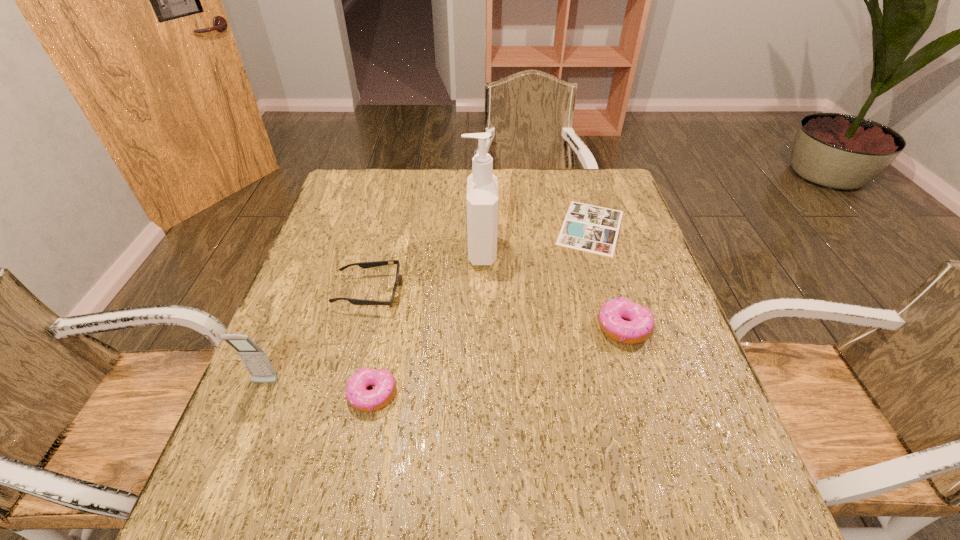
This screenshot has width=960, height=540. In order to click on vacant space located 0.090m on the front of the left doughnut in this screenshot , I will do `click(359, 462)`.

Locate an element on the screen. vacant area situated 0.180m on the back of the farther doughnut is located at coordinates (603, 258).

I want to click on vacant space located on the front label of the fourth object from left to right, so click(x=320, y=251).

Image resolution: width=960 pixels, height=540 pixels. In order to click on free space located 0.100m on the front label of the fourth object from left to right in this screenshot , I will do `click(428, 251)`.

Image resolution: width=960 pixels, height=540 pixels. What are the coordinates of `vacant space located 0.060m on the front label of the fourth object from left to right` in the screenshot? It's located at (443, 251).

The height and width of the screenshot is (540, 960). I want to click on free location located 0.120m on the front of the shortest object, so click(609, 290).

Identify the location of vacant point located 0.110m on the front-facing side of the cellular telephone. point(243,440).

Find the location of a particular element. The width and height of the screenshot is (960, 540). free spot located 0.130m on the front-facing side of the sunglasses is located at coordinates (453, 293).

Identify the location of object that is at the far edge. The width and height of the screenshot is (960, 540). (588, 228).

Locate an element on the screen. The height and width of the screenshot is (540, 960). cellular telephone that is at the left edge is located at coordinates (254, 358).